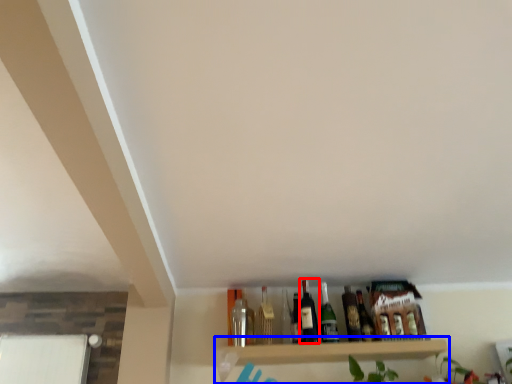
Question: Which object appears farthest to the camera in this image, beer bottle (highlighted by a red box) or shelf (highlighted by a blue box)?

Choices:
 (A) beer bottle
 (B) shelf

Answer: (A)